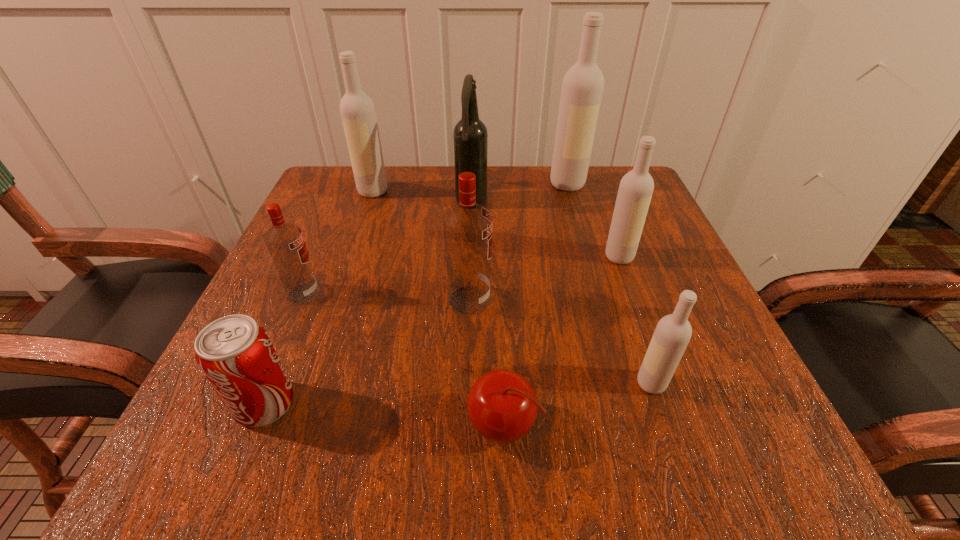
Where is `vacant space at the far edge`? The height and width of the screenshot is (540, 960). vacant space at the far edge is located at coordinates (514, 200).

What are the coordinates of `blank space at the left edge` in the screenshot? It's located at click(345, 256).

Where is `vacant space at the right edge of the desktop`? The width and height of the screenshot is (960, 540). vacant space at the right edge of the desktop is located at coordinates (629, 345).

Locate an element on the screen. free region at the far left corner of the desktop is located at coordinates (371, 218).

Identify the location of vacant area at the near left corner of the desktop. pos(299,471).

Image resolution: width=960 pixels, height=540 pixels. I want to click on vacant space at the near right corner of the desktop, so click(763, 470).

In order to click on vacant space that is in between the nearest white vodka and the fifth shortest vodka in this screenshot , I will do click(512, 287).

Image resolution: width=960 pixels, height=540 pixels. Identify the location of empty space that is in between the biggest white vodka and the smaller red vodka. (436, 239).

You are a GUI agent. You are given a task and a screenshot of the screen. Output one action in this format:
    pyautogui.click(x=<x>, y=<y>)
    Task: Click on the free point between the shortest object and the biggest white vodka
    The width and height of the screenshot is (960, 540).
    Given the screenshot: What is the action you would take?
    pyautogui.click(x=535, y=305)

Find the location of a particular element. The image size is (960, 540). vacant region between the right red vodka and the biggest white vodka is located at coordinates (518, 242).